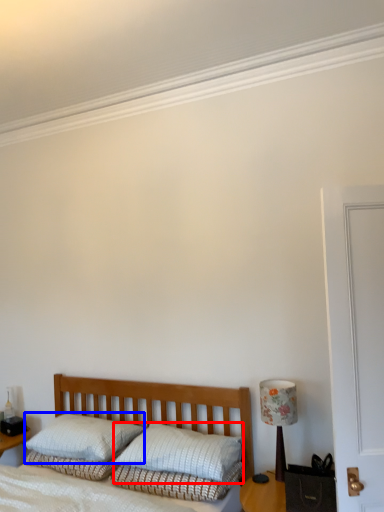
Question: Which point is further to the camera, pillow (highlighted by a red box) or pillow (highlighted by a blue box)?

Choices:
 (A) pillow
 (B) pillow

Answer: (B)